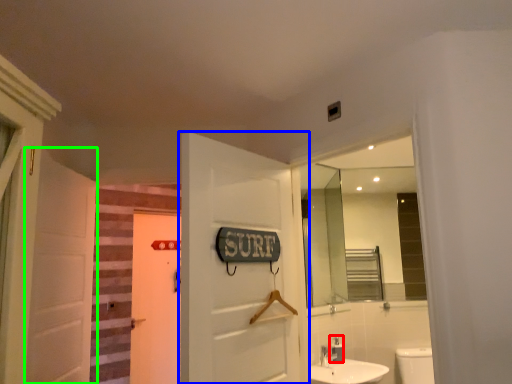
Question: Based on their relative distances, which object is nearer to toiletry (highlighted by a red box)? Choose from door (highlighted by a blue box) and door (highlighted by a green box).

Choices:
 (A) door
 (B) door

Answer: (A)